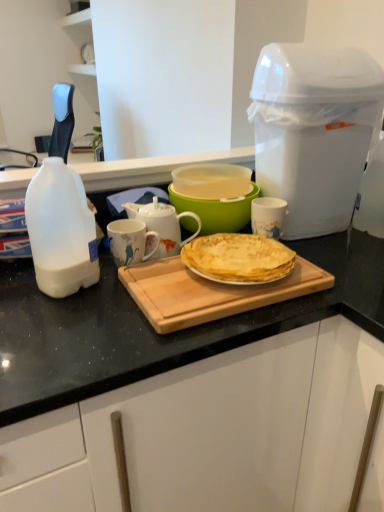
Question: Is the position of white ceramic mug at center less distant than that of white glossy mug at center, acting as the 2th mug starting from the left?

Choices:
 (A) no
 (B) yes

Answer: (B)

Question: Would you consider white ceramic mug at center to be distant from white glossy mug at center, acting as the 2th mug starting from the left?

Choices:
 (A) yes
 (B) no

Answer: (B)

Question: From a real-world perspective, is white ceramic mug at center beneath white glossy mug at center, acting as the 2th mug starting from the left?

Choices:
 (A) yes
 (B) no

Answer: (B)

Question: Can you confirm if white ceramic mug at center is taller than white glossy mug at center, which is the first mug from right to left?

Choices:
 (A) yes
 (B) no

Answer: (A)

Question: Is white ceramic mug at center at the left side of white glossy mug at center, acting as the 2th mug starting from the left?

Choices:
 (A) no
 (B) yes

Answer: (B)

Question: Is white glossy mug at center, acting as the 2th mug starting from the left, inside white ceramic mug at center?

Choices:
 (A) no
 (B) yes

Answer: (A)

Question: From the image's perspective, is wooden cutting board at center under white ceramic mug at center, positioned as the 2th mug in right-to-left order?

Choices:
 (A) no
 (B) yes

Answer: (B)

Question: Is wooden cutting board at center positioned behind white ceramic mug at center, positioned as the 2th mug in right-to-left order?

Choices:
 (A) yes
 (B) no

Answer: (B)

Question: Is white ceramic mug at center, positioned as the 2th mug in right-to-left order, inside wooden cutting board at center?

Choices:
 (A) yes
 (B) no

Answer: (B)

Question: Can you confirm if wooden cutting board at center is bigger than white ceramic mug at center, positioned as the 2th mug in right-to-left order?

Choices:
 (A) no
 (B) yes

Answer: (B)

Question: Considering the relative sizes of wooden cutting board at center and white ceramic mug at center, positioned as the 2th mug in right-to-left order, in the image provided, is wooden cutting board at center thinner than white ceramic mug at center, positioned as the 2th mug in right-to-left order,?

Choices:
 (A) yes
 (B) no

Answer: (B)

Question: Is wooden cutting board at center placed right next to white ceramic mug at center, positioned as the 2th mug in right-to-left order?

Choices:
 (A) yes
 (B) no

Answer: (B)

Question: Is white plastic trash can at upper right not within white ceramic mug at center?

Choices:
 (A) yes
 (B) no

Answer: (A)